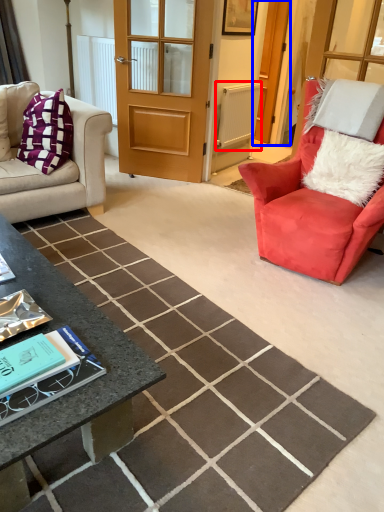
Question: Which object appears farthest to the camera in this image, radiator (highlighted by a red box) or screen door (highlighted by a blue box)?

Choices:
 (A) radiator
 (B) screen door

Answer: (B)